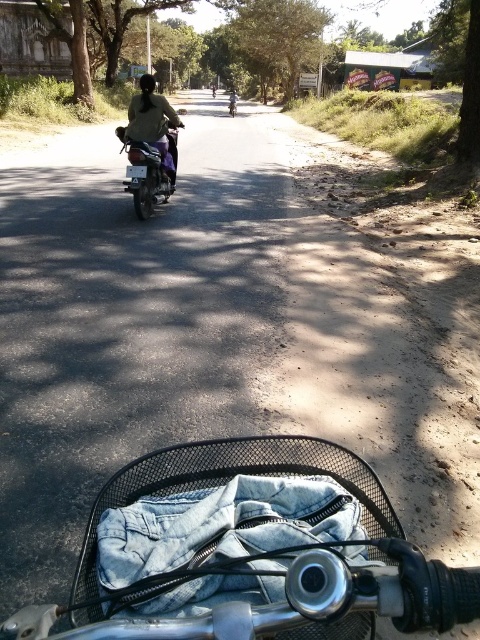
Question: Which point is closer to the camera?

Choices:
 (A) (166, 131)
 (B) (140, 96)

Answer: (B)

Question: Which of the following is the closest to the observer?

Choices:
 (A) (172, 154)
 (B) (156, 163)

Answer: (B)

Question: Does metallic blue motorcycle at center have a smaller size compared to light brown fabric shirt at center?

Choices:
 (A) yes
 (B) no

Answer: (B)

Question: Which point is closer to the camera?

Choices:
 (A) metallic blue motorcycle at center
 (B) light brown fabric shirt at center

Answer: (A)

Question: Observing the image, what is the correct spatial positioning of metallic blue motorcycle at center in reference to light brown fabric shirt at center?

Choices:
 (A) right
 (B) left

Answer: (B)

Question: In this image, where is metallic blue motorcycle at center located relative to light brown fabric shirt at center?

Choices:
 (A) right
 (B) left

Answer: (B)